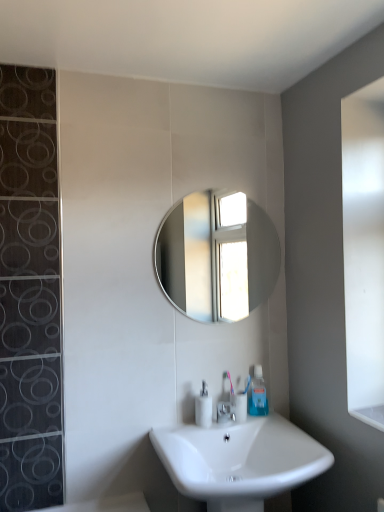
Question: From the image's perspective, would you say shiny silver mirror at center is positioned over white glossy soap dispenser at center?

Choices:
 (A) no
 (B) yes

Answer: (B)

Question: Is shiny silver mirror at center oriented towards white glossy soap dispenser at center?

Choices:
 (A) yes
 (B) no

Answer: (B)

Question: Can you confirm if shiny silver mirror at center is positioned to the left of white glossy soap dispenser at center?

Choices:
 (A) yes
 (B) no

Answer: (B)

Question: Is shiny silver mirror at center further to camera compared to white glossy soap dispenser at center?

Choices:
 (A) yes
 (B) no

Answer: (A)

Question: Can you confirm if shiny silver mirror at center is smaller than white glossy soap dispenser at center?

Choices:
 (A) no
 (B) yes

Answer: (A)

Question: Does shiny silver mirror at center appear on the right side of white glossy soap dispenser at center?

Choices:
 (A) no
 (B) yes

Answer: (B)

Question: Is the position of silver metallic faucet at center more distant than that of clear plastic toothpaste tube at lower center?

Choices:
 (A) yes
 (B) no

Answer: (B)

Question: Would you say silver metallic faucet at center is outside clear plastic toothpaste tube at lower center?

Choices:
 (A) no
 (B) yes

Answer: (B)

Question: Does silver metallic faucet at center appear on the right side of clear plastic toothpaste tube at lower center?

Choices:
 (A) yes
 (B) no

Answer: (B)

Question: Can you confirm if silver metallic faucet at center is bigger than clear plastic toothpaste tube at lower center?

Choices:
 (A) no
 (B) yes

Answer: (A)

Question: Is silver metallic faucet at center positioned far away from clear plastic toothpaste tube at lower center?

Choices:
 (A) yes
 (B) no

Answer: (B)

Question: Is silver metallic faucet at center facing towards clear plastic toothpaste tube at lower center?

Choices:
 (A) yes
 (B) no

Answer: (B)

Question: Is white glossy sink at lower center to the right of clear plastic toothpaste tube at lower center from the viewer's perspective?

Choices:
 (A) no
 (B) yes

Answer: (A)